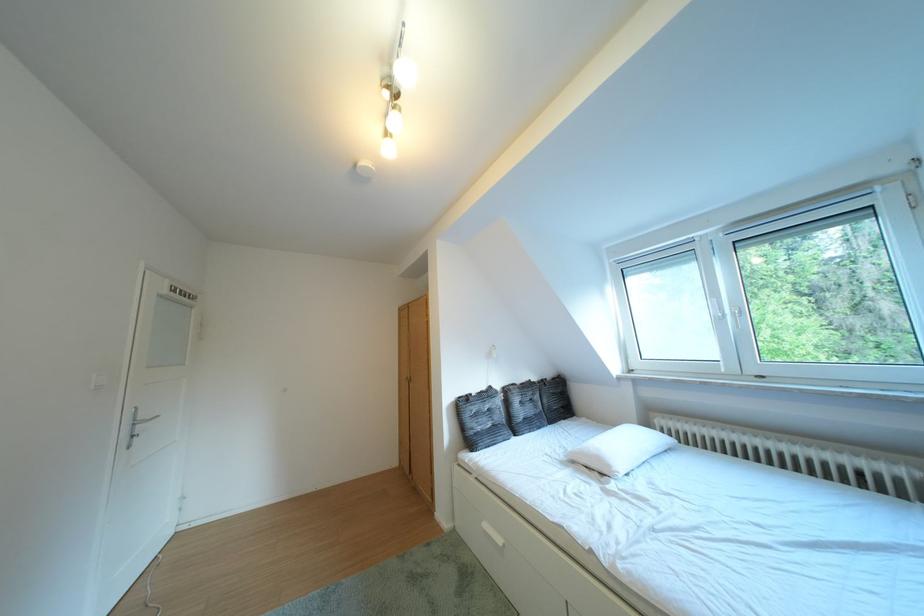
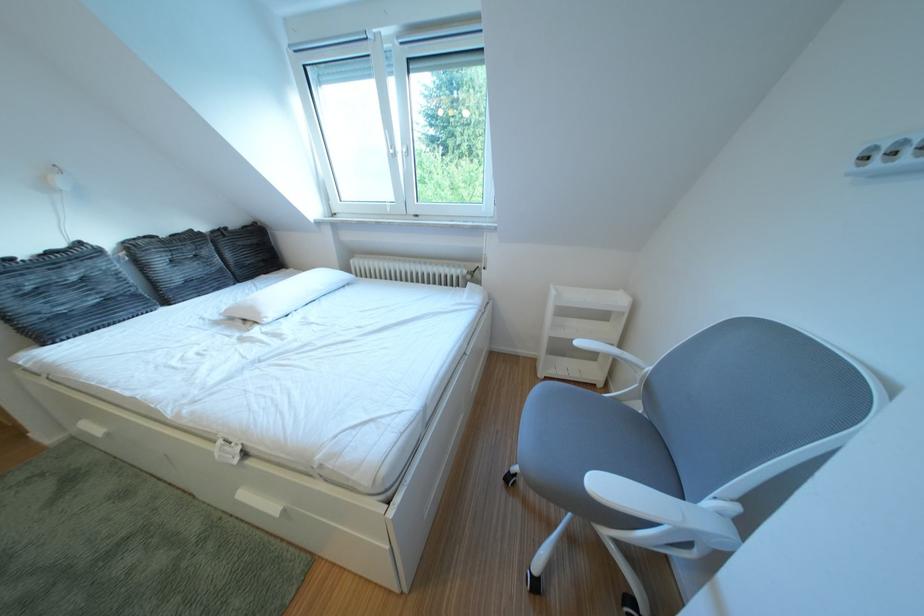
In the second image, find the point that corresponds to pixel 531 387 in the first image.

(176, 240)